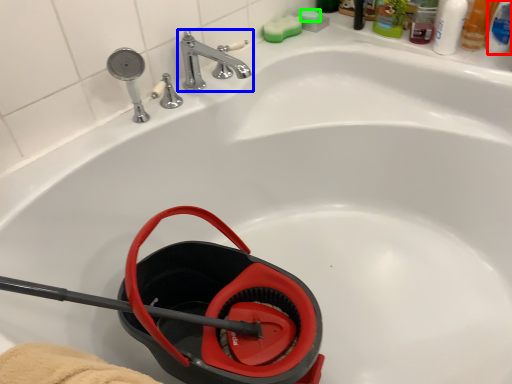
Question: Considering the real-world distances, which object is farthest from mouthwash (highlighted by a red box)? tap (highlighted by a blue box) or soap (highlighted by a green box)?

Choices:
 (A) tap
 (B) soap

Answer: (A)